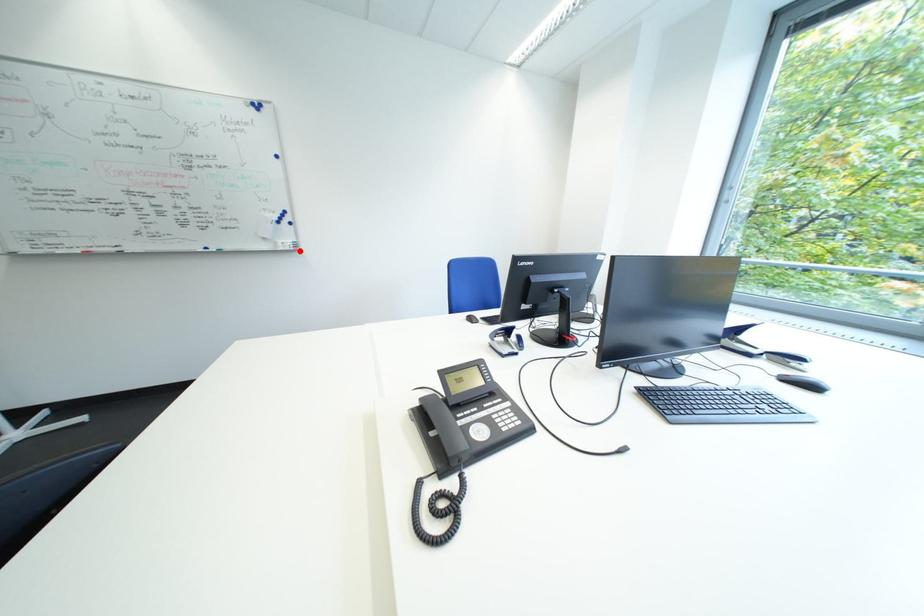
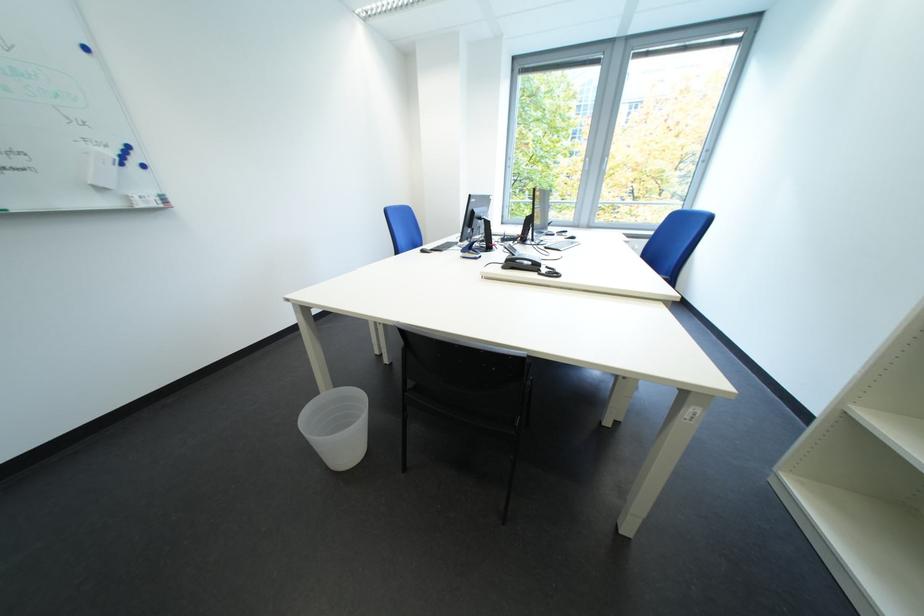
Where in the second image is the point corresponding to the highlighted location from the first image?

(165, 208)